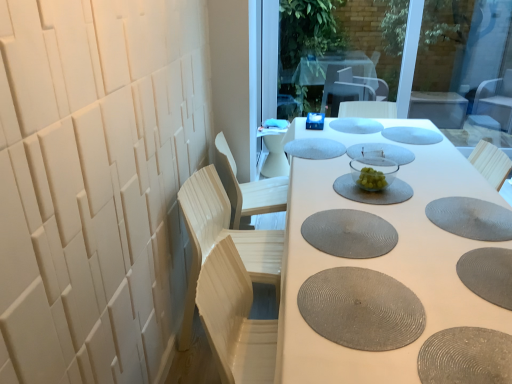
Locate an element on the screen. free spot to the left of clear glass bowl at center is located at coordinates (335, 187).